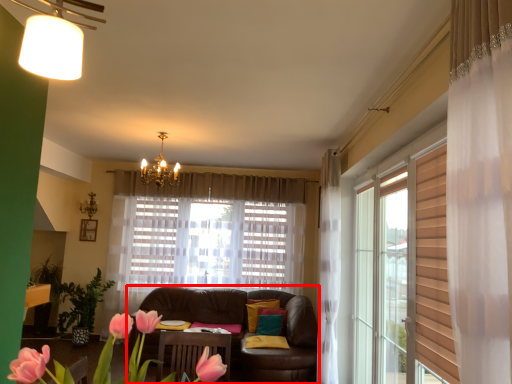
Question: Where is studio couch (annotated by the red box) located in relation to floral arrangement in the image?

Choices:
 (A) left
 (B) right

Answer: (B)